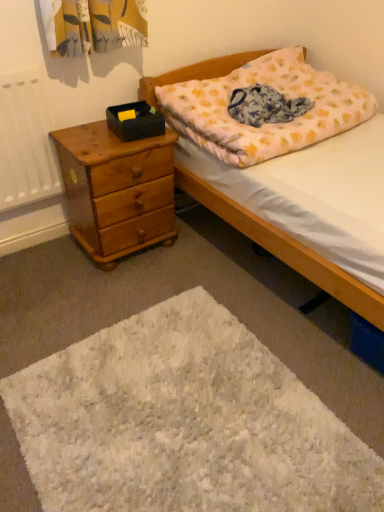
At what (x,y) coordinates should I click in order to perform the action: click on empty space that is ontop of white fluffy mat at lower center (from a real-world perspective). Please return your answer as a coordinate pair (x, y). The height and width of the screenshot is (512, 384). Looking at the image, I should click on (177, 410).